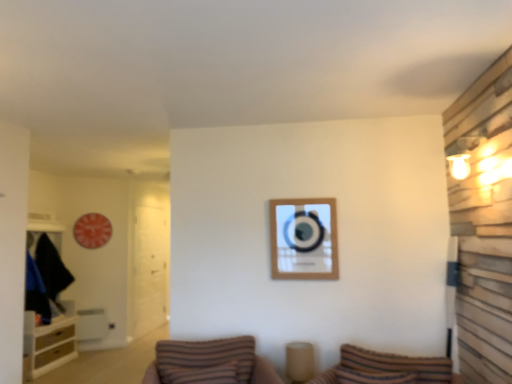
Question: In terms of height, does striped fabric pillow at lower center look taller or shorter compared to transparent glass door at left?

Choices:
 (A) tall
 (B) short

Answer: (B)

Question: Looking at their shapes, would you say striped fabric pillow at lower center is wider or thinner than transparent glass door at left?

Choices:
 (A) thin
 (B) wide

Answer: (B)

Question: Considering the real-world distances, which object is farthest from the wooden cabinet at left?

Choices:
 (A) transparent glass door at left
 (B) brown striped pillow at center
 (C) wooden picture frame at center
 (D) striped fabric pillow at lower center

Answer: (D)

Question: Based on their relative distances, which object is nearer to the transparent glass door at left?

Choices:
 (A) wooden cabinet at left
 (B) wooden picture frame at center
 (C) striped fabric pillow at lower center
 (D) brown striped pillow at center

Answer: (A)